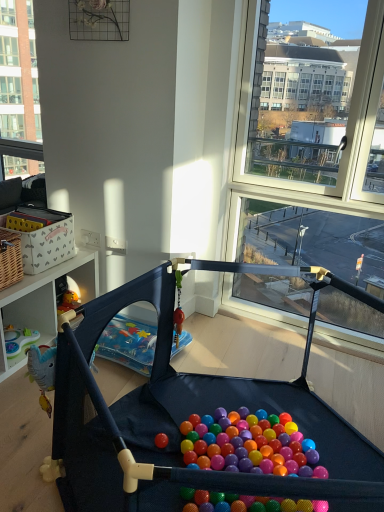
Question: In terms of size, does clear glass window at upper left appear bigger or smaller than matte black playpen at center?

Choices:
 (A) big
 (B) small

Answer: (B)

Question: From a real-world perspective, is clear glass window at upper left positioned above or below matte black playpen at center?

Choices:
 (A) below
 (B) above

Answer: (B)

Question: Is clear glass window at upper left in front of or behind matte black playpen at center in the image?

Choices:
 (A) front
 (B) behind

Answer: (B)

Question: Does point (82, 351) appear closer or farther from the camera than point (36, 117)?

Choices:
 (A) farther
 (B) closer

Answer: (B)

Question: Is matte black playpen at center spatially inside clear glass window at upper left, or outside of it?

Choices:
 (A) outside
 (B) inside

Answer: (A)

Question: Considering the positions of matte black playpen at center and clear glass window at upper left in the image, is matte black playpen at center taller or shorter than clear glass window at upper left?

Choices:
 (A) short
 (B) tall

Answer: (A)

Question: Considering their positions, is matte black playpen at center located in front of or behind clear glass window at upper left?

Choices:
 (A) behind
 (B) front

Answer: (B)